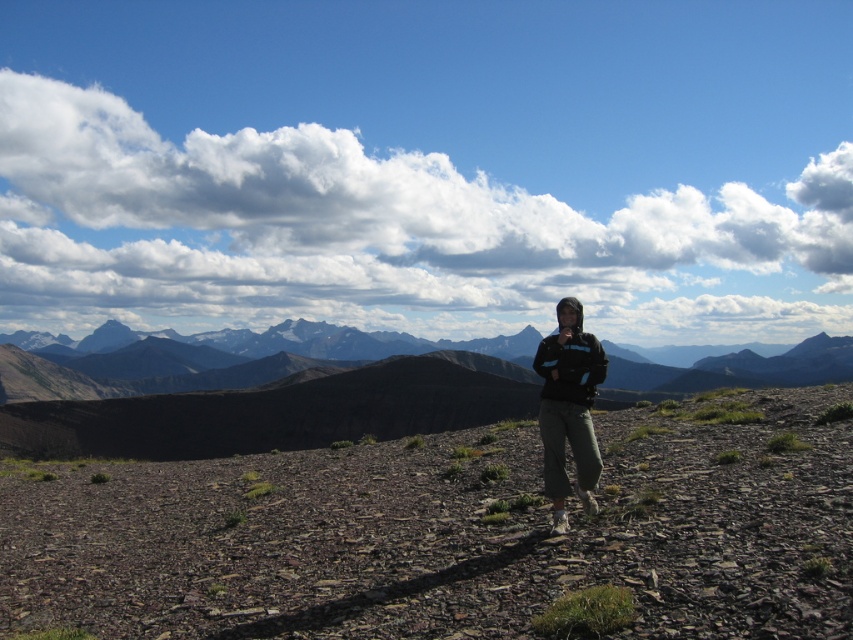
You are a hiker standing at the edge of the rugged terrain. You notice the dull brown dirt at center and the black fabric jacket at center. Which object is taller when viewed from your current position?

The dull brown dirt at center is taller than the black fabric jacket at center according to the description.

You are standing at the point marked as point (91, 474) in the image. You want to walk straight towards the camera. How far will you have to walk to reach the camera?

You are 20.71 meters away from the camera, so you will have to walk 20.71 meters to reach it.

You are a hiker who just arrived at the scene. You see the dull brown dirt at center and the black fabric jacket at center. Which object is closer to the ground?

The dull brown dirt at center is closer to the ground as it is located below the black fabric jacket at center.